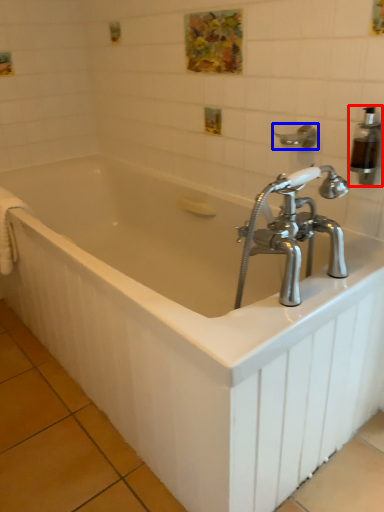
Question: Which object appears closest to the camera in this image, soap dispenser (highlighted by a red box) or shower (highlighted by a blue box)?

Choices:
 (A) soap dispenser
 (B) shower

Answer: (A)